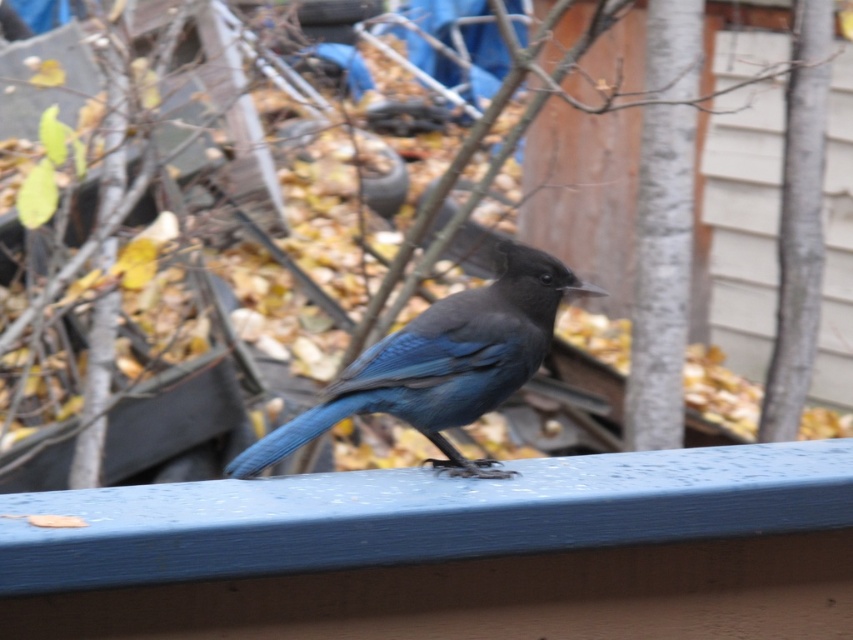
Looking at this image, you are standing in front of the wooden structure and want to place two markers at the locations of point (x=766, y=570) and point (x=396, y=358). Which marker should you place first if you want to start with the one closer to you?

You should place the marker at point (x=766, y=570) first because it is closer to you than point (x=396, y=358).

From the picture: You are a photographer trying to capture the blue painted wood at center and the satin blue bird at center in a single frame. Given that your camera can only focus on objects within a 1.2 meter width, can both objects fit side by side in the frame?

The blue painted wood at center is wider than the satin blue bird at center. However, since the camera can focus on objects within a 1.2 meter width, both objects can fit side by side as long as their combined width does not exceed 1.2 meters. The exact feasibility depends on their individual widths, but the description only states the blue painted wood is wider, not the total combined measurement.

You are a photographer aiming to capture the blue painted wood at center and the satin blue bird at center in a single frame. Based on their positions, which object will appear closer to the camera in the photo?

The blue painted wood at center is in front of the satin blue bird at center, so it will appear closer to the camera in the photo.